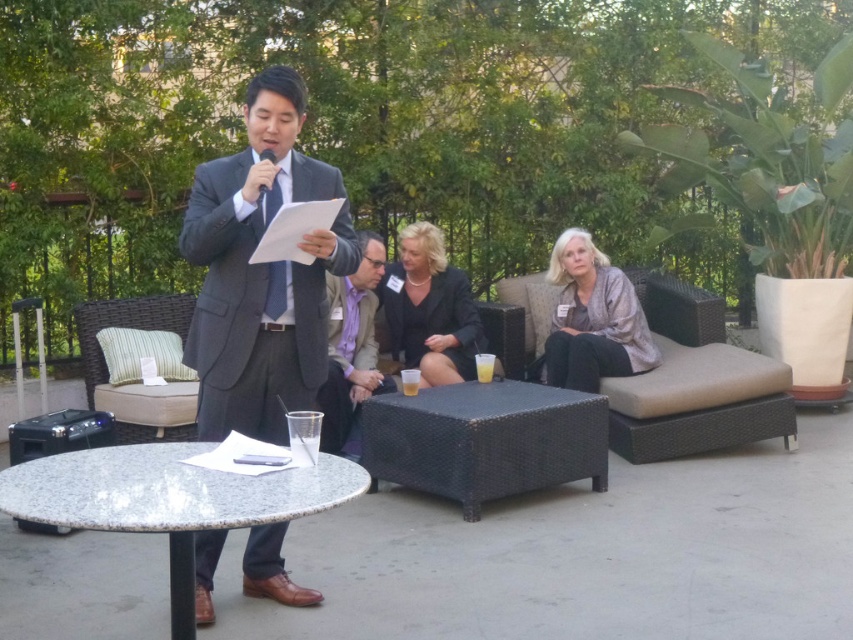
You are organizing a small event and need to determine if there is enough space for a 1.5 meter wide banner between the dark gray suit at center and the granite table at center. Based on the scene description, can the banner fit?

The dark gray suit at center occupies less space than the granite table at center, so the banner may not fit between them as the space available might be limited by the size of the suit and table. However, the exact dimensions aren